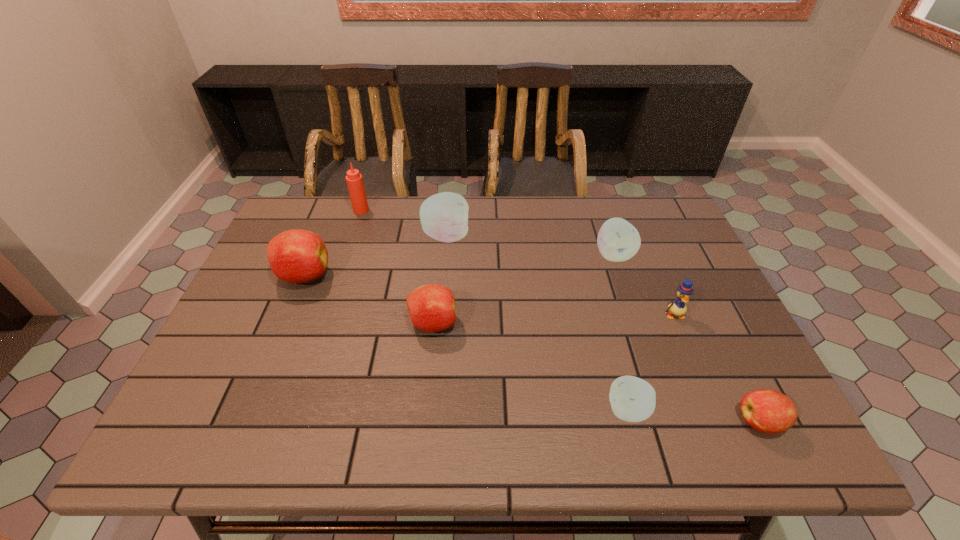
Where is `vacant region that satisfies the following two spatial constraints: 1. on the front side of the smallest white apple; 2. on the left side of the biggest white apple`? The width and height of the screenshot is (960, 540). vacant region that satisfies the following two spatial constraints: 1. on the front side of the smallest white apple; 2. on the left side of the biggest white apple is located at coordinates (431, 410).

Identify the location of free space in the image that satisfies the following two spatial constraints: 1. on the front side of the smallest white apple; 2. on the right side of the leftmost apple. (249, 410).